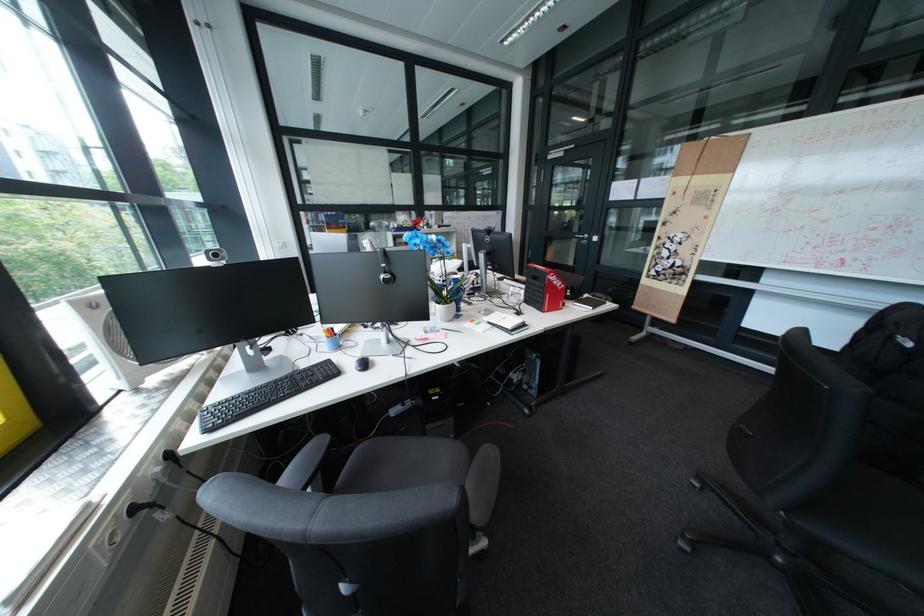
The image size is (924, 616). I want to click on black computer mouse, so click(361, 363).